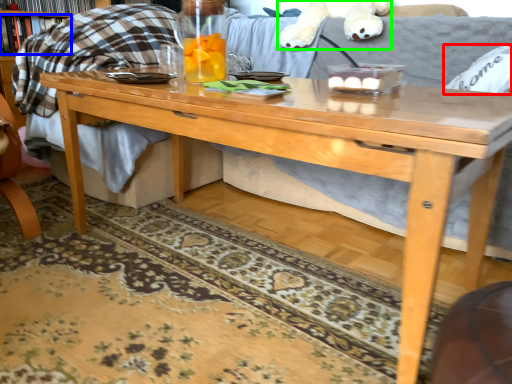
Question: Which object is the farthest from pillow (highlighted by a red box)? Choose among these: book (highlighted by a blue box) or animal (highlighted by a green box).

Choices:
 (A) book
 (B) animal

Answer: (A)